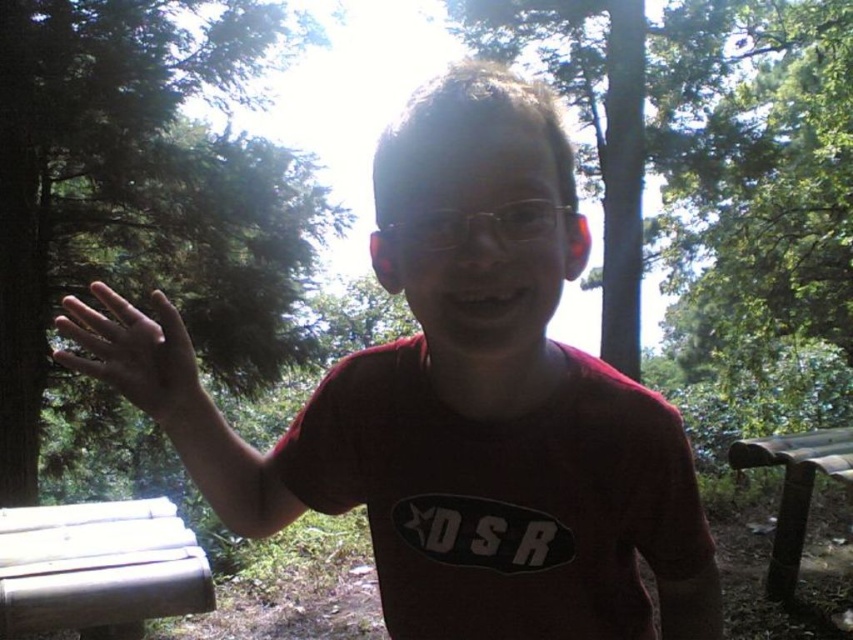
You are a photographer trying to capture the clear plastic glasses at center without including the green leafy tree at left in the frame. Based on their positions, can you adjust your camera angle to achieve this?

The green leafy tree at left is above clear plastic glasses at center, so you can lower your camera angle to avoid capturing the tree while focusing on the glasses.

You are a photographer wanting to capture a photo of the boy while ensuring both the white wood bench at lower left and the brown wooden bench at lower right are visible in the frame. Which bench should you position closer to the camera to include both in the shot?

To include both the white wood bench at lower left and the brown wooden bench at lower right in the frame, position the white wood bench at lower left closer to the camera since it is already in front of the brown wooden bench at lower right.

You are standing in the forest and see the green leafy tree at left. If you want to walk towards it, which direction should you head?

The green leafy tree at left is located at point 0.295 on the x axis and 0.166 on the y axis, so you should walk towards the left side to reach it.